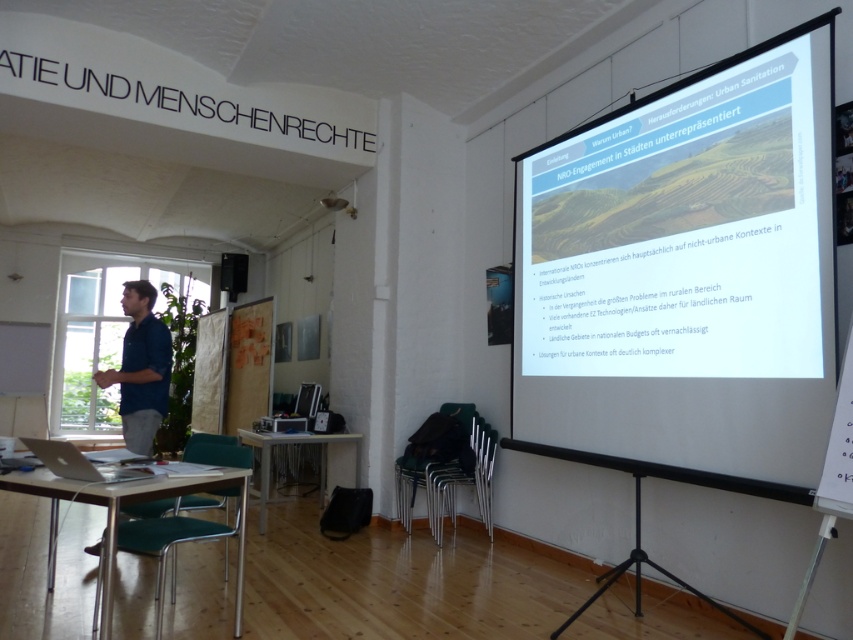
Is point (817, 468) farther from viewer compared to point (125, 486)?

No, it is not.

Between white matte projection screen at upper right and metallic silver table at lower left, which one appears on the left side from the viewer's perspective?

Positioned to the left is metallic silver table at lower left.

Does point (750, 353) lie in front of point (140, 486)?

That is False.

At what (x,y) coordinates should I click in order to perform the action: click on white matte projection screen at upper right. Please return your answer as a coordinate pair (x, y). Looking at the image, I should click on (685, 276).

Is metallic silver table at lower left wider than wooden table at center?

Incorrect, metallic silver table at lower left's width does not surpass wooden table at center's.

Which is in front, point (236, 474) or point (288, 444)?

Point (236, 474)

Locate an element on the screen. The width and height of the screenshot is (853, 640). metallic silver table at lower left is located at coordinates (117, 515).

Is point (793, 417) more distant than point (126, 292)?

No.

The height and width of the screenshot is (640, 853). What are the coordinates of `white matte projection screen at upper right` in the screenshot? It's located at (685, 276).